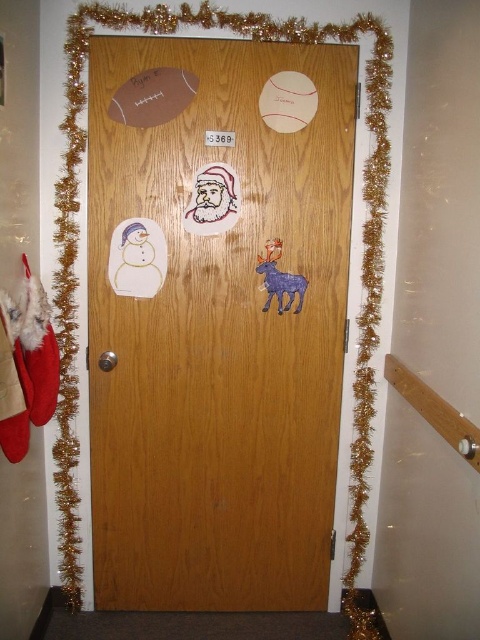
You are standing in front of the festive wooden door decorated with various cutouts. The coordinates given are in a normalized system where the bottom left corner is the origin. Where is the wooden door located relative to the point marked at coordinates point (216, 321)?

The point (216, 321) marks the center of the wooden door, so the wooden door is centered at that point.

You are standing in front of the wooden door at center. If you want to reach it, how many steps do you need to take if each step covers approximately 2 feet?

The wooden door at center is 6.19 feet away from you. Since each step covers about 2 feet, you would need to take 3 steps to reach it, as 6.19 divided by 2 is approximately 3.1, which rounds up to 3 steps.

You are standing in front of the festive wooden door and want to touch both the wooden door at center and the matte paper santa at center. Which object will you need to reach further to touch?

You will need to reach further to touch the matte paper santa at center because it is positioned further away from you compared to the wooden door at center, which is closer.